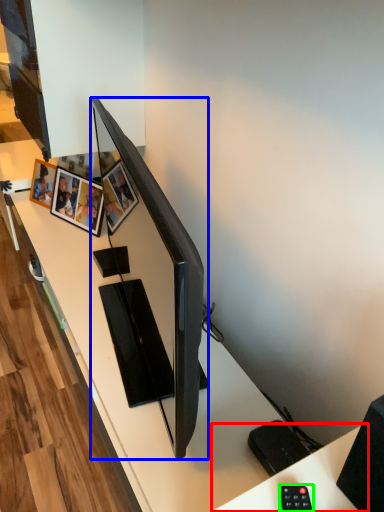
Question: Estimate the real-world distances between objects in this image. Which object is closer to computer desk (highlighted by a red box), television (highlighted by a blue box) or control (highlighted by a green box)?

Choices:
 (A) television
 (B) control

Answer: (B)